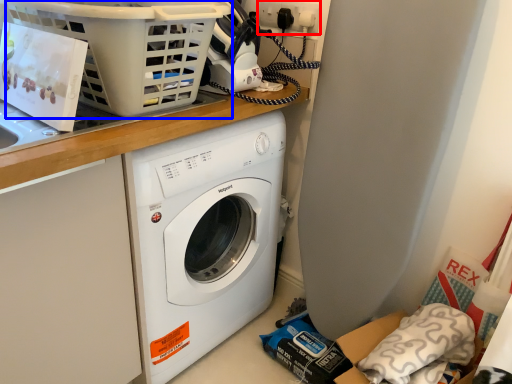
Question: Which of the following is the farthest to the observer, electric outlet (highlighted by a red box) or basket (highlighted by a blue box)?

Choices:
 (A) electric outlet
 (B) basket

Answer: (A)